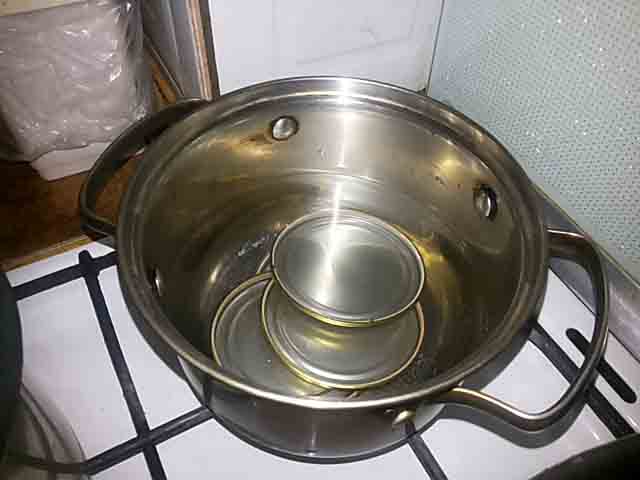
This screenshot has width=640, height=480. In order to click on wall in this screenshot , I will do `click(349, 28)`, `click(553, 98)`.